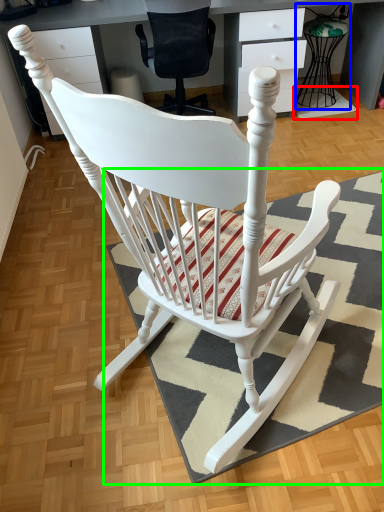
Question: Which object is positioned farthest from doormat (highlighted by a red box)? Select from feeding chair (highlighted by a blue box) and doormat (highlighted by a green box).

Choices:
 (A) feeding chair
 (B) doormat

Answer: (B)